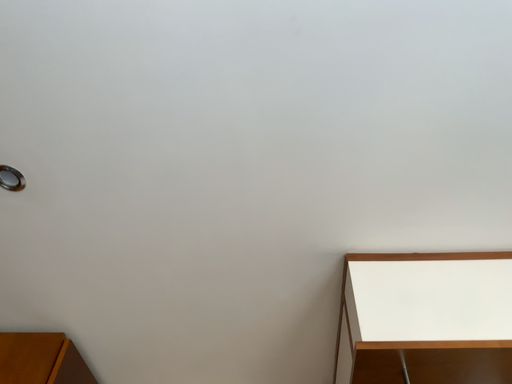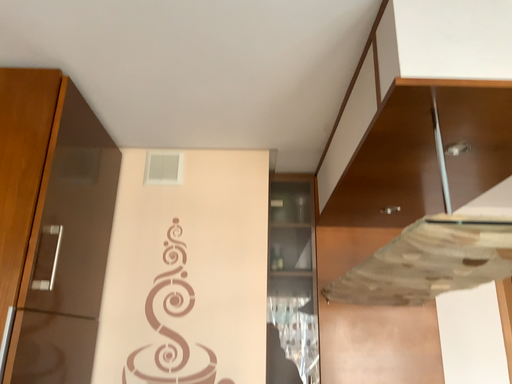
Question: How did the camera likely rotate when shooting the video?

Choices:
 (A) rotated downward
 (B) rotated upward

Answer: (A)